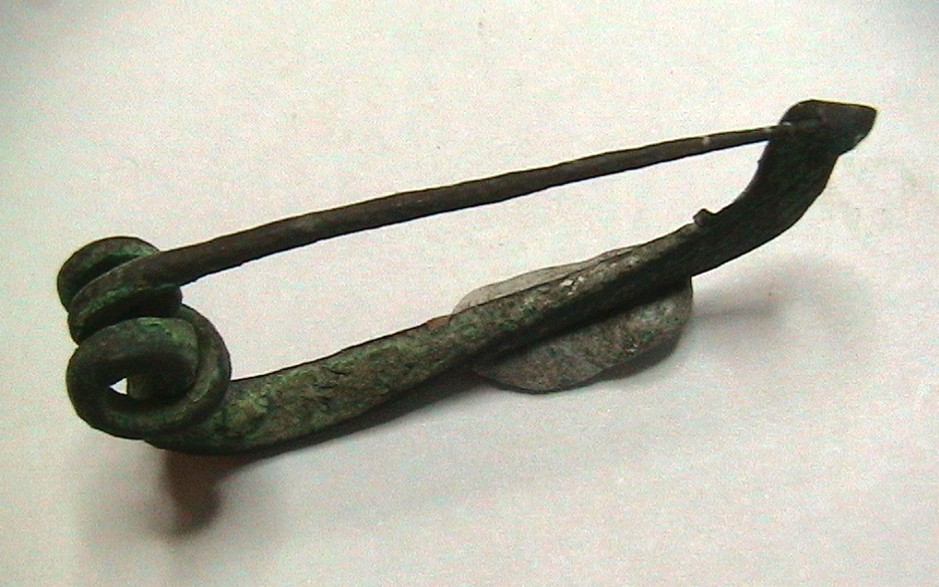
Find the location of a particular element. The height and width of the screenshot is (587, 939). metal artpiece is located at coordinates pyautogui.click(x=437, y=360).